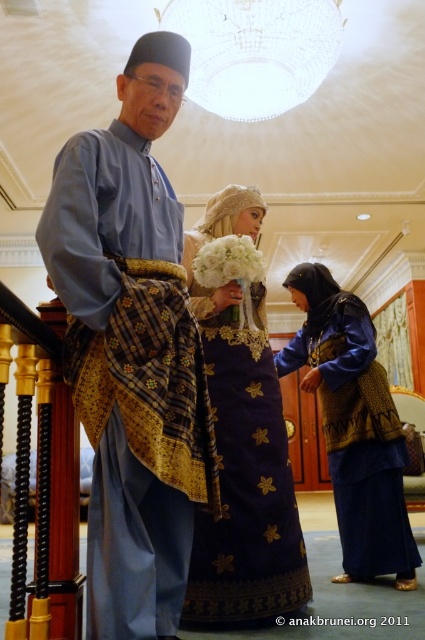
You are attending a formal event and need to choose between two dresses displayed in the scene. The blue silk dress at center and the blue textured fabric dress at lower right. Which dress has a wider silhouette?

The blue textured fabric dress at lower right has a wider silhouette than the blue silk dress at center.

In the image of the formal indoor ceremony scene, there is a man in a light blue kurta and a point labeled at coordinates (133, 349). What object is located at that coordinate?

Answer: The point at coordinates (133, 349) indicates the location of the matte blue shirt at center.

In the grand hall scene, there are two dresses present. The first is a blue silk dress at center, and the second is a blue textured fabric dress at lower right. From the perspective of someone standing at the entrance facing the scene, which dress is positioned to the left?

The blue silk dress at center is positioned to the left of the blue textured fabric dress at lower right.